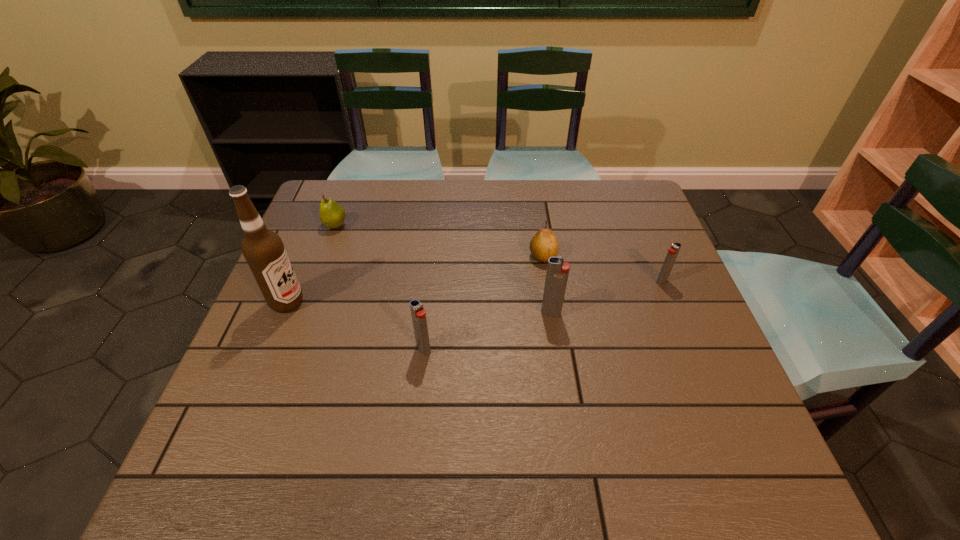
The height and width of the screenshot is (540, 960). In order to click on object situated at the far left corner in this screenshot , I will do [332, 215].

In order to click on vacant space at the far edge of the desktop in this screenshot , I will do `click(516, 215)`.

This screenshot has width=960, height=540. In the image, there is a desktop. Find the location of `vacant space at the near edge`. vacant space at the near edge is located at coordinates (338, 427).

In order to click on vacant space at the left edge in this screenshot , I will do `click(323, 307)`.

In the image, there is a desktop. Where is `vacant space at the right edge`? Image resolution: width=960 pixels, height=540 pixels. vacant space at the right edge is located at coordinates coord(716,388).

At what (x,y) coordinates should I click in order to perform the action: click on free space at the far left corner of the desktop. Please return your answer as a coordinate pair (x, y). Looking at the image, I should click on (312, 215).

You are a GUI agent. You are given a task and a screenshot of the screen. Output one action in this format:
    pyautogui.click(x=<x>, y=<y>)
    Task: Click on the vacant space at the far right corner of the desktop
    
    Given the screenshot: What is the action you would take?
    pyautogui.click(x=619, y=216)

Where is `empty space that is in between the second farthest igniter and the fourth shortest object`? empty space that is in between the second farthest igniter and the fourth shortest object is located at coordinates (488, 331).

Where is `vacant area that lies between the second farthest igniter and the left pear`? The image size is (960, 540). vacant area that lies between the second farthest igniter and the left pear is located at coordinates (444, 269).

The image size is (960, 540). I want to click on empty space between the second igniter from left to right and the rightmost igniter, so click(607, 297).